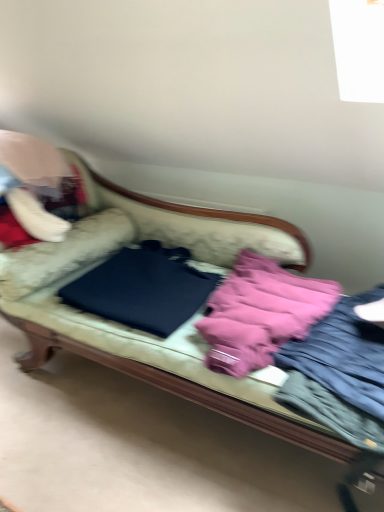
Identify the location of black matte laptop at center. This screenshot has height=512, width=384. (143, 288).

Describe the element at coordinates (343, 355) in the screenshot. I see `pink fabric jacket at right` at that location.

Where is `black matte laptop at center`? black matte laptop at center is located at coordinates (143, 288).

Does velvet fabric couch at center contain pink fabric jacket at right?

Yes, pink fabric jacket at right is surrounded by velvet fabric couch at center.

Is the position of velvet fabric couch at center more distant than that of pink fabric jacket at right?

No, velvet fabric couch at center is closer to the camera.

Considering the sizes of objects velvet fabric couch at center and pink fabric jacket at right in the image provided, who is taller, velvet fabric couch at center or pink fabric jacket at right?

Standing taller between the two is velvet fabric couch at center.

Considering the sizes of objects velvet fabric couch at center and pink fabric jacket at right in the image provided, who is thinner, velvet fabric couch at center or pink fabric jacket at right?

With smaller width is pink fabric jacket at right.

Based on the photo, based on their positions, is black matte laptop at center located to the left or right of pink fabric jacket at right?

black matte laptop at center is to the left of pink fabric jacket at right.

From the image's perspective, is black matte laptop at center located beneath pink fabric jacket at right?

Incorrect, from the image's perspective, black matte laptop at center is higher than pink fabric jacket at right.

Is black matte laptop at center aimed at pink fabric jacket at right?

No, black matte laptop at center is not facing towards pink fabric jacket at right.

Which object is more forward, black matte laptop at center or pink fabric jacket at right?

pink fabric jacket at right is closer to the camera.

From a real-world perspective, between pink fabric jacket at right and velvet fabric couch at center, who is vertically lower?

From a 3D spatial view, velvet fabric couch at center is below.

Is pink fabric jacket at right bigger than velvet fabric couch at center?

Incorrect, pink fabric jacket at right is not larger than velvet fabric couch at center.

Considering the sizes of objects pink fabric jacket at right and velvet fabric couch at center in the image provided, who is taller, pink fabric jacket at right or velvet fabric couch at center?

Standing taller between the two is velvet fabric couch at center.

Is point (348, 382) behind point (193, 301)?

No, (348, 382) is closer to viewer.

Can you confirm if pink fabric jacket at right is thinner than black matte laptop at center?

Incorrect, the width of pink fabric jacket at right is not less than that of black matte laptop at center.

How distant is pink fabric jacket at right from black matte laptop at center?

A distance of 53.59 centimeters exists between pink fabric jacket at right and black matte laptop at center.

Looking at this image, is pink fabric jacket at right aimed at black matte laptop at center?

No, pink fabric jacket at right is not aimed at black matte laptop at center.

From a real-world perspective, who is located higher, velvet fabric couch at center or pink fabric at center?

pink fabric at center is physically above.

Which of these two, velvet fabric couch at center or pink fabric at center, is thinner?

With smaller width is pink fabric at center.

Relative to pink fabric at center, is velvet fabric couch at center in front or behind?

velvet fabric couch at center is positioned closer to the viewer than pink fabric at center.

Which object is positioned more to the left, velvet fabric couch at center or pink fabric at center?

velvet fabric couch at center.

Can you tell me how much pink fabric jacket at right and pink fabric at center differ in facing direction?

There is a 0.00103-degree angle between the facing directions of pink fabric jacket at right and pink fabric at center.

From a real-world perspective, is pink fabric jacket at right on pink fabric at center?

No, from a real-world perspective, pink fabric jacket at right is not on top of pink fabric at center.

Would you say pink fabric at center is part of pink fabric jacket at right's contents?

No, pink fabric at center is not surrounded by pink fabric jacket at right.

Is pink fabric jacket at right looking in the opposite direction of pink fabric at center?

That's not correct — pink fabric jacket at right is not looking away from pink fabric at center.

Based on their positions, is pink fabric at center located to the left or right of pink fabric jacket at right?

From the image, it's evident that pink fabric at center is to the left of pink fabric jacket at right.

Is pink fabric jacket at right at the back of pink fabric at center?

No, pink fabric at center is not facing away from pink fabric jacket at right.

Is pink fabric at center inside the boundaries of pink fabric jacket at right, or outside?

pink fabric at center exists outside the volume of pink fabric jacket at right.

Consider the image. Is pink fabric at center bigger than pink fabric jacket at right?

Indeed, pink fabric at center has a larger size compared to pink fabric jacket at right.

Image resolution: width=384 pixels, height=512 pixels. Find the location of `clothing behind the velvet fabric couch at center`. clothing behind the velvet fabric couch at center is located at coordinates (343, 355).

The image size is (384, 512). What are the coordinates of `clothing on the right of black matte laptop at center` in the screenshot? It's located at (343, 355).

Estimate the real-world distances between objects in this image. Which object is closer to pink fabric at center, black matte laptop at center or velvet fabric couch at center?

black matte laptop at center is positioned closer to the anchor pink fabric at center.

Considering their positions, is black matte laptop at center positioned closer to velvet fabric couch at center than pink fabric at center?

The object closer to velvet fabric couch at center is black matte laptop at center.

Estimate the real-world distances between objects in this image. Which object is further from pink fabric jacket at right, black matte laptop at center or velvet fabric couch at center?

The object further to pink fabric jacket at right is black matte laptop at center.

Based on the photo, considering their positions, is pink fabric jacket at right positioned closer to pink fabric at center than black matte laptop at center?

Based on the image, pink fabric jacket at right appears to be nearer to pink fabric at center.

When comparing their distances from pink fabric at center, does black matte laptop at center or pink fabric jacket at right seem closer?

pink fabric jacket at right.

Looking at the image, which one is located closer to velvet fabric couch at center, pink fabric at center or pink fabric jacket at right?

pink fabric at center is closer to velvet fabric couch at center.

Which object lies further to the anchor point pink fabric at center, pink fabric jacket at right or velvet fabric couch at center?

Among the two, velvet fabric couch at center is located further to pink fabric at center.

Estimate the real-world distances between objects in this image. Which object is closer to black matte laptop at center, velvet fabric couch at center or pink fabric at center?

Based on the image, velvet fabric couch at center appears to be nearer to black matte laptop at center.

Identify the location of studio couch between black matte laptop at center and pink fabric jacket at right in the horizontal direction. (144, 412).

Image resolution: width=384 pixels, height=512 pixels. Identify the location of material located between velvet fabric couch at center and pink fabric jacket at right in the left-right direction. (260, 313).

Where is `material located between velvet fabric couch at center and black matte laptop at center in the depth direction`? The height and width of the screenshot is (512, 384). material located between velvet fabric couch at center and black matte laptop at center in the depth direction is located at coordinates (260, 313).

I want to click on material between black matte laptop at center and pink fabric jacket at right in the horizontal direction, so click(x=260, y=313).